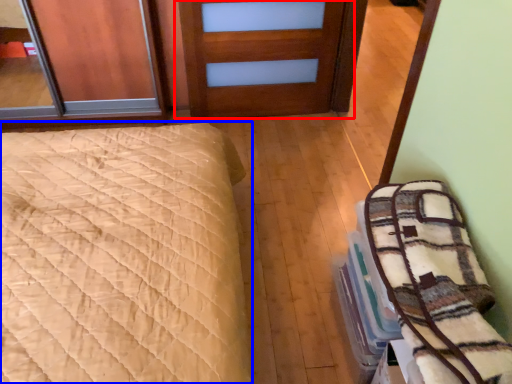
Question: Which object is further to the camera taking this photo, door (highlighted by a red box) or bed (highlighted by a blue box)?

Choices:
 (A) door
 (B) bed

Answer: (A)